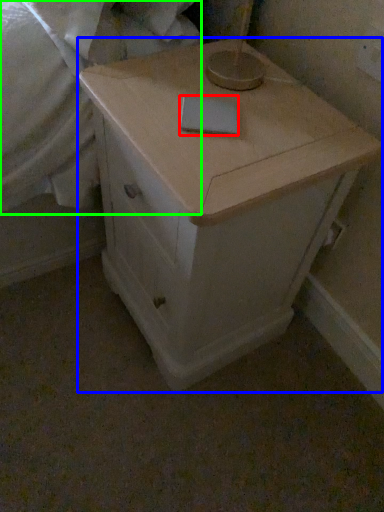
Question: Estimate the real-world distances between objects in this image. Which object is farther from notepad (highlighted by a red box), chest of drawers (highlighted by a blue box) or sheet (highlighted by a green box)?

Choices:
 (A) chest of drawers
 (B) sheet

Answer: (B)